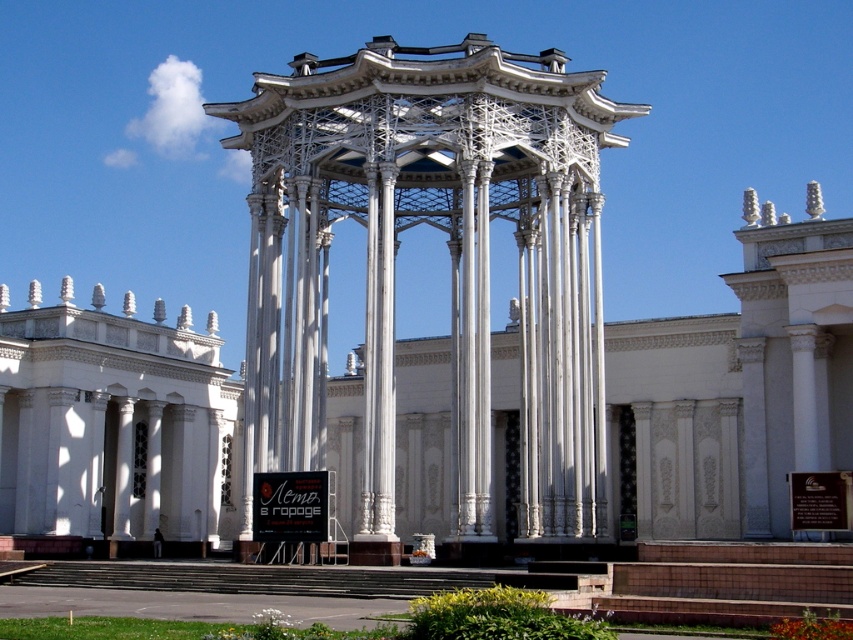
You are standing in front of the grand architectural structure and want to take a photo of the white marble columns at center and the white metallic gazebo at center. Which object should you focus on first if you want to capture both in your shot without moving the camera?

The white marble columns at center are located below the white metallic gazebo at center, so you should focus on the white marble columns at center first to ensure both are in frame without moving the camera.

You are an architect designing a new garden layout. You need to place a statue between the white marble columns at center and the white metallic gazebo at center. Which object should the statue be closer to if the columns are wider than the gazebo?

The statue should be closer to the white marble columns at center because they are wider than the white metallic gazebo at center, allowing for a balanced composition.

You are planning to host a small outdoor event and need to decide between using the white marble columns at center or the white metallic gazebo at center for setting up a stage. Based on their sizes, which one would provide more space for the stage setup?

The white marble columns at center is larger in size than the white metallic gazebo at center, so the white marble columns at center would provide more space for the stage setup.